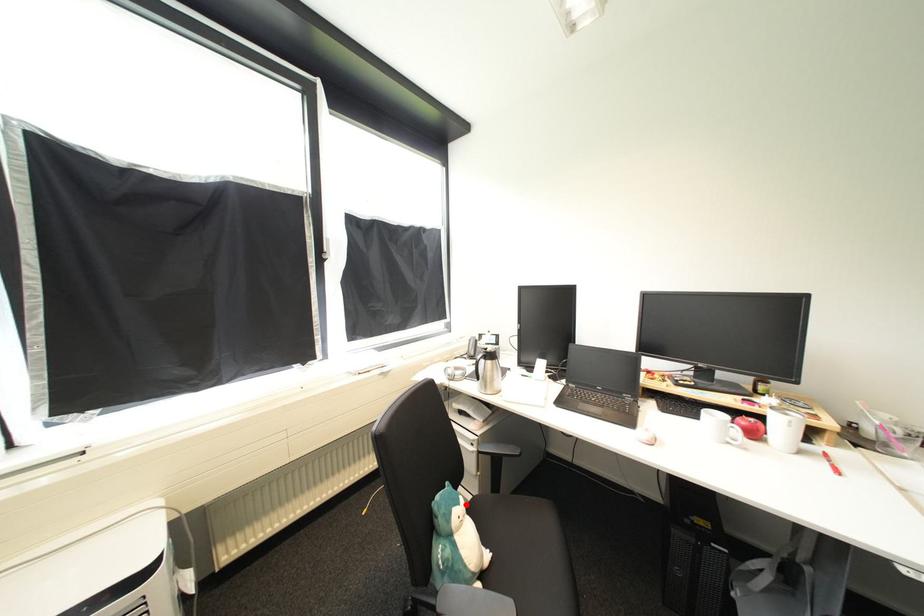
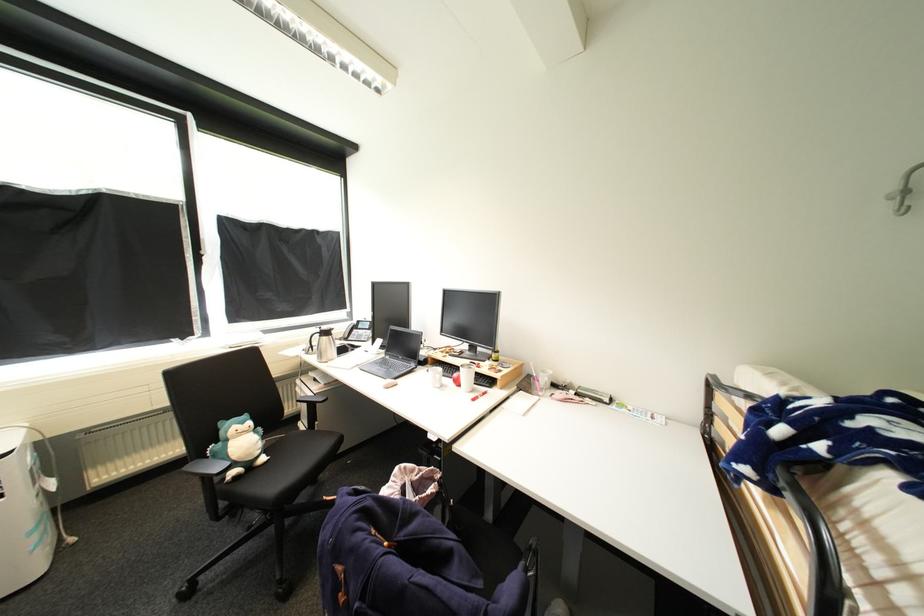
In the second image, find the point that corresponds to the highlighted location in the first image.

(249, 424)